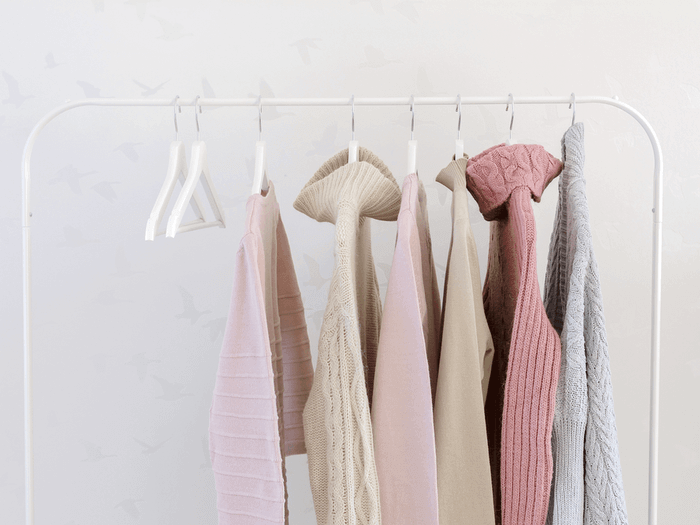
At what (x,y) coordinates should I click in order to perform the action: click on hangers. Please return your answer as a coordinate pair (x, y). Looking at the image, I should click on (160, 206), (185, 207), (256, 175), (354, 145), (413, 151), (458, 150), (510, 139), (574, 109).